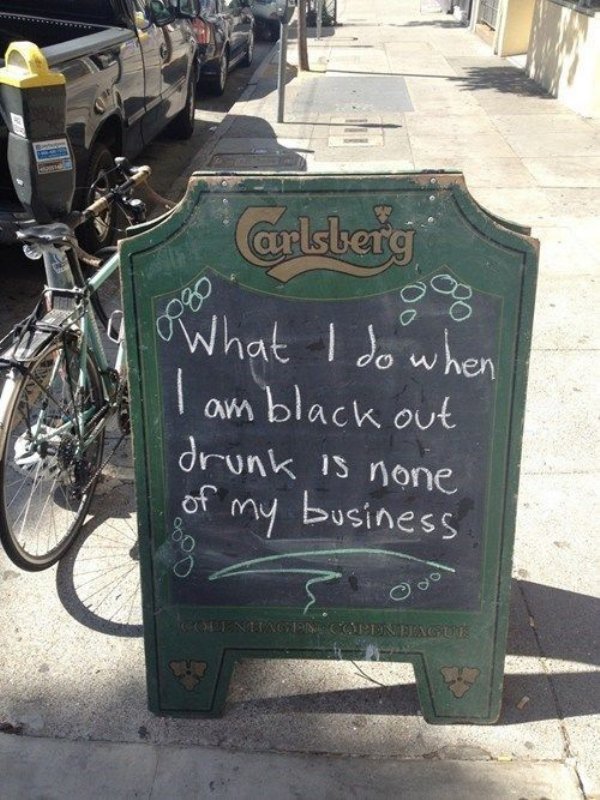
Identify the location of blackboard. The image size is (600, 800). (307, 362).